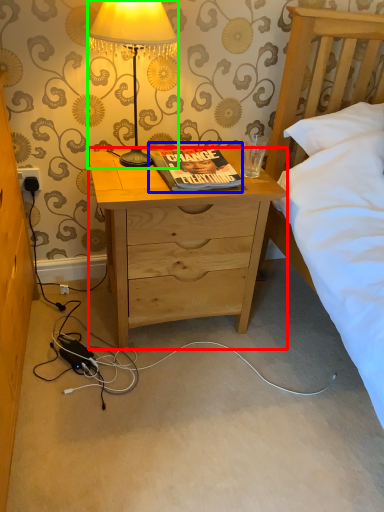
Question: Based on their relative distances, which object is nearer to desk (highlighted by a red box)? Choose from book (highlighted by a blue box) and lamp (highlighted by a green box).

Choices:
 (A) book
 (B) lamp

Answer: (A)